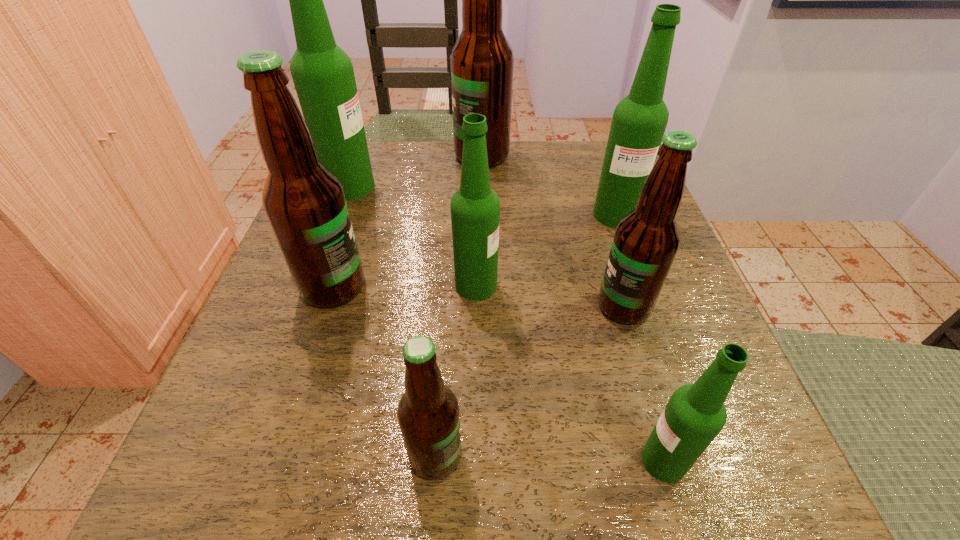
You are a GUI agent. You are given a task and a screenshot of the screen. Output one action in this format:
    pyautogui.click(x=<x>, y=<y>)
    Task: Click on the vacant space that's between the second nearest green beer bottle and the second biggest brown beer bottle
    The width and height of the screenshot is (960, 540).
    Given the screenshot: What is the action you would take?
    pyautogui.click(x=405, y=286)

Find the location of a particular element. Image resolution: width=960 pixels, height=540 pixels. free spot between the sixth nearest object and the smallest brown beer bottle is located at coordinates (525, 335).

Find the location of `free area in between the smallest brown beer bottle and the third nearest green beer bottle`. free area in between the smallest brown beer bottle and the third nearest green beer bottle is located at coordinates (525, 335).

Locate an element on the screen. vacant space that's between the smallest green beer bottle and the second smallest brown beer bottle is located at coordinates (644, 383).

This screenshot has width=960, height=540. I want to click on object that stands as the fifth closest to the second farthest beer bottle, so click(646, 240).

Where is `object that is the second closest to the nearest green beer bottle`? This screenshot has height=540, width=960. object that is the second closest to the nearest green beer bottle is located at coordinates (428, 413).

Where is `beer bottle that is the sixth nearest to the leftmost green beer bottle`? This screenshot has width=960, height=540. beer bottle that is the sixth nearest to the leftmost green beer bottle is located at coordinates (428, 413).

Locate an element on the screen. This screenshot has width=960, height=540. the fourth closest beer bottle relative to the third farthest green beer bottle is located at coordinates (639, 121).

Choose which brown beer bottle is the second nearest neighbor to the rightmost brown beer bottle. Please provide its 2D coordinates. Your answer should be formatted as a tuple, i.e. [(x, y)], where the tuple contains the x and y coordinates of a point satisfying the conditions above.

[(304, 201)]

Locate an element on the screen. the second closest brown beer bottle to the seventh nearest object is located at coordinates (304, 201).